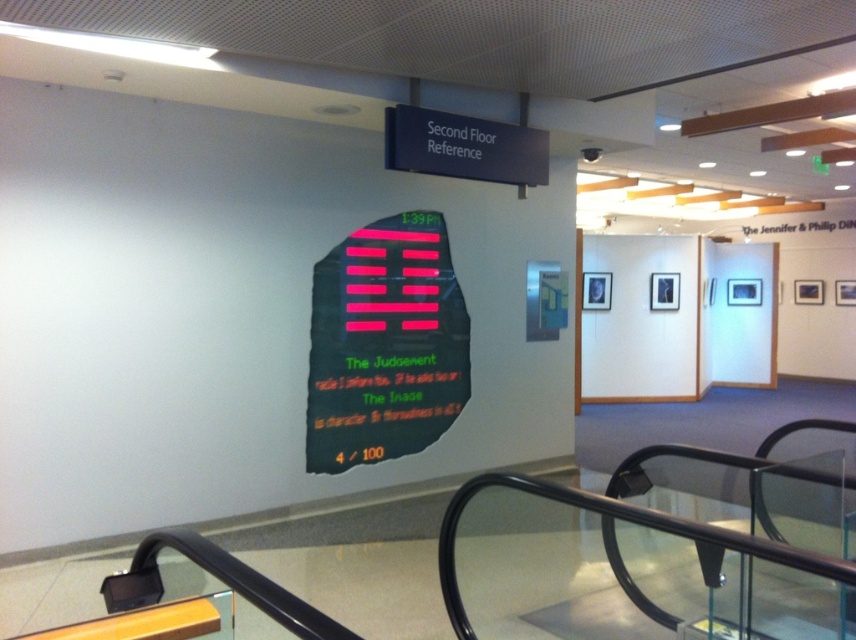
Who is taller, pink matte sign at center or black plastic sign at upper center?

Standing taller between the two is pink matte sign at center.

Between point (399, 365) and point (446, 128), which one is positioned in front?

Positioned in front is point (446, 128).

Which is behind, point (364, 266) or point (425, 125)?

The point (364, 266) is more distant.

Find the location of a particular element. The image size is (856, 640). pink matte sign at center is located at coordinates (384, 344).